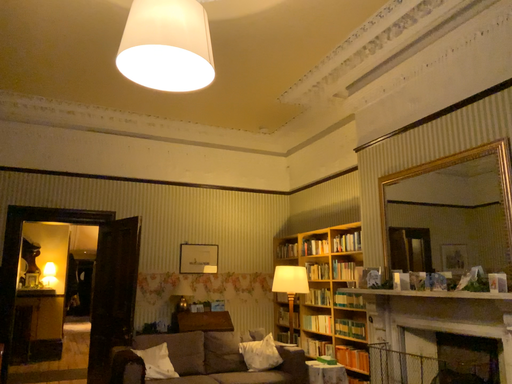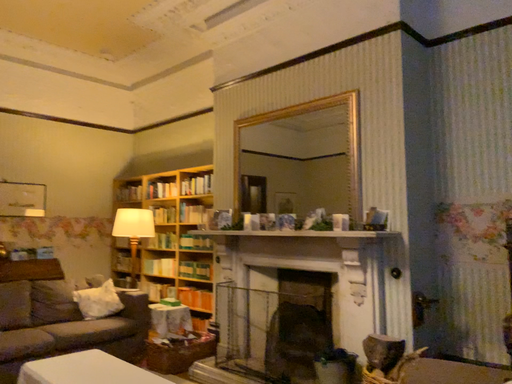
Question: Which way did the camera rotate in the video?

Choices:
 (A) rotated downward
 (B) rotated upward

Answer: (A)